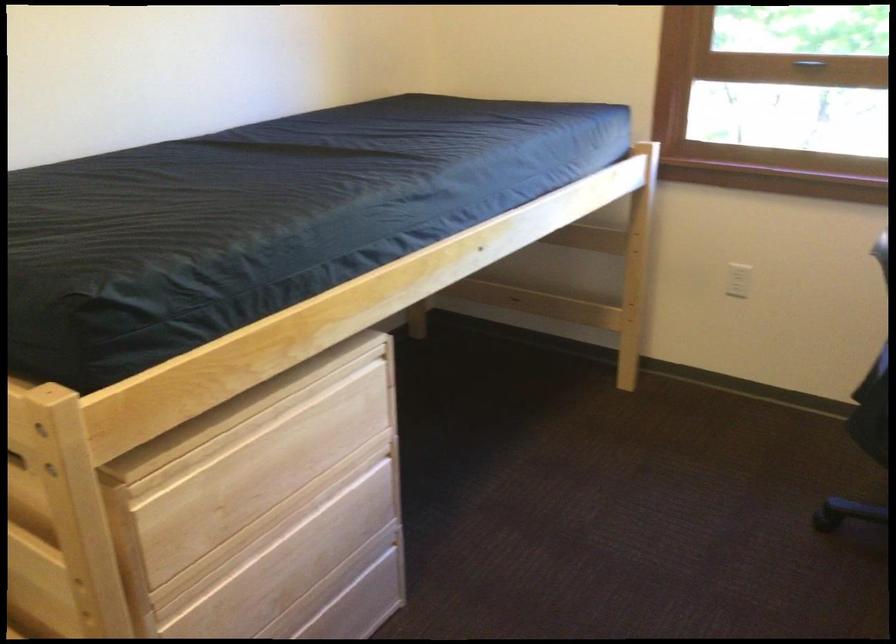
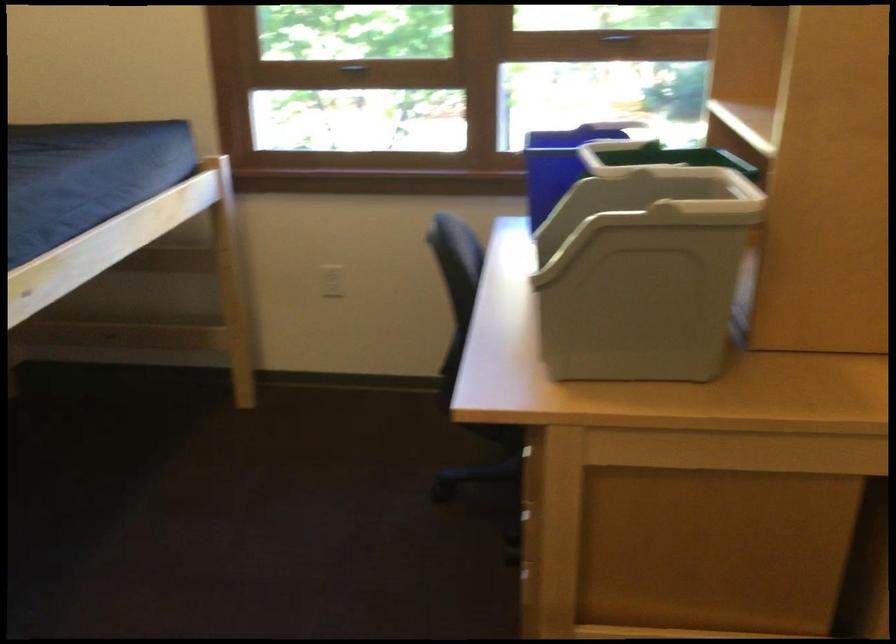
Question: Which direction would the cameraman need to move to produce the second image? Reply with the corresponding letter.

Choices:
 (A) Left
 (B) Right
 (C) Forward
 (D) Backward

Answer: (B)